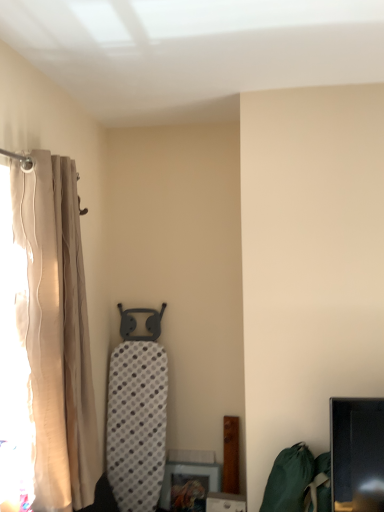
Question: Should I look upward or downward to see green fabric bean bag chair at lower right?

Choices:
 (A) up
 (B) down

Answer: (B)

Question: Considering the relative positions of beige fabric curtain at left and green fabric bean bag chair at lower right in the image provided, is beige fabric curtain at left to the right of green fabric bean bag chair at lower right from the viewer's perspective?

Choices:
 (A) yes
 (B) no

Answer: (B)

Question: Can you confirm if beige fabric curtain at left is thinner than green fabric bean bag chair at lower right?

Choices:
 (A) yes
 (B) no

Answer: (A)

Question: Does beige fabric curtain at left touch green fabric bean bag chair at lower right?

Choices:
 (A) no
 (B) yes

Answer: (A)

Question: Considering the relative sizes of beige fabric curtain at left and green fabric bean bag chair at lower right in the image provided, is beige fabric curtain at left bigger than green fabric bean bag chair at lower right?

Choices:
 (A) no
 (B) yes

Answer: (B)

Question: Can you confirm if beige fabric curtain at left is wider than green fabric bean bag chair at lower right?

Choices:
 (A) no
 (B) yes

Answer: (A)

Question: Does beige fabric curtain at left come behind green fabric bean bag chair at lower right?

Choices:
 (A) no
 (B) yes

Answer: (A)

Question: Could beige fabric curtain at left be considered to be inside green fabric bean bag chair at lower right?

Choices:
 (A) yes
 (B) no

Answer: (B)

Question: Can you confirm if green fabric bean bag chair at lower right is taller than beige fabric curtain at left?

Choices:
 (A) no
 (B) yes

Answer: (A)

Question: Does green fabric bean bag chair at lower right appear on the left side of beige fabric curtain at left?

Choices:
 (A) yes
 (B) no

Answer: (B)

Question: Can you confirm if green fabric bean bag chair at lower right is thinner than beige fabric curtain at left?

Choices:
 (A) no
 (B) yes

Answer: (A)

Question: From the image's perspective, is green fabric bean bag chair at lower right over beige fabric curtain at left?

Choices:
 (A) yes
 (B) no

Answer: (B)

Question: Is green fabric bean bag chair at lower right placed right next to beige fabric curtain at left?

Choices:
 (A) no
 (B) yes

Answer: (A)

Question: From the image's perspective, is beige fabric curtain at left located above or below green fabric bean bag chair at lower right?

Choices:
 (A) above
 (B) below

Answer: (A)